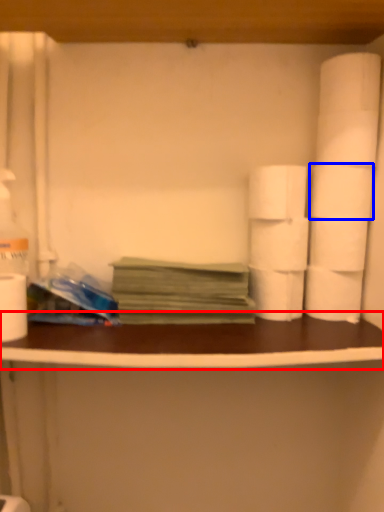
Question: Which point is further to the camera, counter top (highlighted by a red box) or toilet paper (highlighted by a blue box)?

Choices:
 (A) counter top
 (B) toilet paper

Answer: (B)